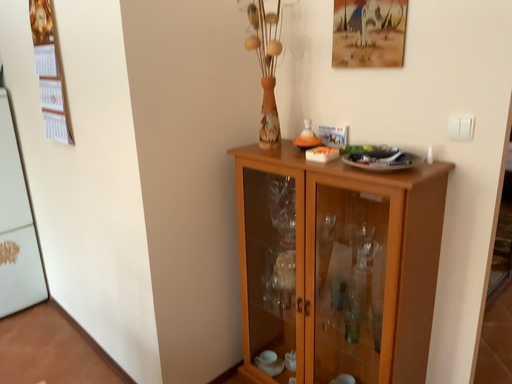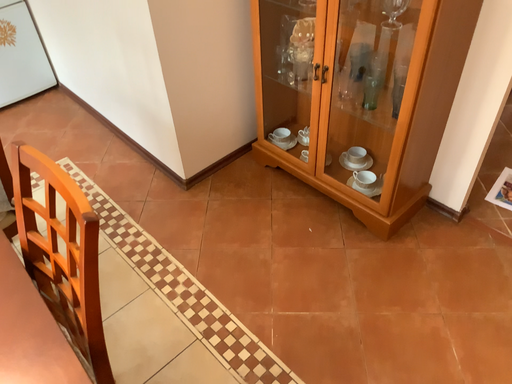
Question: Which way did the camera rotate in the video?

Choices:
 (A) rotated upward
 (B) rotated downward

Answer: (B)